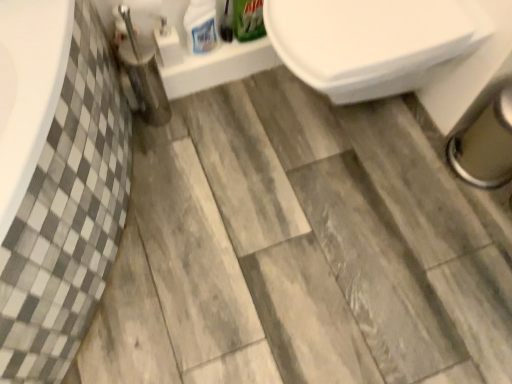
Where is `brushed metal toilet brush at lower left`? This screenshot has height=384, width=512. brushed metal toilet brush at lower left is located at coordinates (143, 74).

Describe the element at coordinates (248, 20) in the screenshot. I see `green matte box at upper center, acting as the second cleaning product starting from the left` at that location.

Describe the element at coordinates (201, 26) in the screenshot. I see `white glossy bottle at upper center, placed as the first cleaning product when sorted from left to right` at that location.

This screenshot has width=512, height=384. What do you see at coordinates (372, 42) in the screenshot?
I see `white glossy toilet at upper right` at bounding box center [372, 42].

This screenshot has height=384, width=512. Find the location of `brushed metal toilet brush at lower left`. brushed metal toilet brush at lower left is located at coordinates (143, 74).

Who is bigger, green matte box at upper center, which is the 1th cleaning product in right-to-left order, or white glossy bottle at upper center, which is the 2th cleaning product from right to left?

Bigger between the two is white glossy bottle at upper center, which is the 2th cleaning product from right to left.

From the image's perspective, between green matte box at upper center, which is the 1th cleaning product in right-to-left order, and white glossy bottle at upper center, placed as the first cleaning product when sorted from left to right, who is located below?

From the image's view, white glossy bottle at upper center, placed as the first cleaning product when sorted from left to right, is below.

Who is more distant, green matte box at upper center, which is the 1th cleaning product in right-to-left order, or white glossy bottle at upper center, placed as the first cleaning product when sorted from left to right?

green matte box at upper center, which is the 1th cleaning product in right-to-left order.

From a real-world perspective, between brushed metal toilet brush at lower left and green matte box at upper center, acting as the second cleaning product starting from the left, who is vertically higher?

green matte box at upper center, acting as the second cleaning product starting from the left, from a real-world perspective.

Is brushed metal toilet brush at lower left positioned with its back to green matte box at upper center, acting as the second cleaning product starting from the left?

No, brushed metal toilet brush at lower left's orientation is not away from green matte box at upper center, acting as the second cleaning product starting from the left.

Is point (141, 42) closer or farther from the camera than point (250, 15)?

Clearly, point (141, 42) is closer to the camera than point (250, 15).

Can you confirm if brushed metal toilet brush at lower left is shorter than green matte box at upper center, which is the 1th cleaning product in right-to-left order?

No.

From a real-world perspective, is green matte box at upper center, acting as the second cleaning product starting from the left, positioned above or below brushed metal toilet brush at lower left?

green matte box at upper center, acting as the second cleaning product starting from the left, is situated higher than brushed metal toilet brush at lower left in the real world.

Can you tell me how much green matte box at upper center, acting as the second cleaning product starting from the left, and brushed metal toilet brush at lower left differ in facing direction?

They differ by 2.97 degrees in their facing directions.

Considering the sizes of objects green matte box at upper center, acting as the second cleaning product starting from the left, and brushed metal toilet brush at lower left in the image provided, who is shorter, green matte box at upper center, acting as the second cleaning product starting from the left, or brushed metal toilet brush at lower left?

Standing shorter between the two is green matte box at upper center, acting as the second cleaning product starting from the left.

Choose the correct answer: Is green matte box at upper center, acting as the second cleaning product starting from the left, inside brushed metal toilet brush at lower left or outside it?

The correct answer is: outside.

From the picture: Considering the positions of objects white glossy bottle at upper center, placed as the first cleaning product when sorted from left to right, and green matte box at upper center, which is the 1th cleaning product in right-to-left order, in the image provided, who is in front, white glossy bottle at upper center, placed as the first cleaning product when sorted from left to right, or green matte box at upper center, which is the 1th cleaning product in right-to-left order,?

white glossy bottle at upper center, placed as the first cleaning product when sorted from left to right, is in front.

Does white glossy bottle at upper center, placed as the first cleaning product when sorted from left to right, turn towards green matte box at upper center, acting as the second cleaning product starting from the left?

No, white glossy bottle at upper center, placed as the first cleaning product when sorted from left to right, does not turn towards green matte box at upper center, acting as the second cleaning product starting from the left.

Considering the relative sizes of white glossy bottle at upper center, placed as the first cleaning product when sorted from left to right, and green matte box at upper center, which is the 1th cleaning product in right-to-left order, in the image provided, is white glossy bottle at upper center, placed as the first cleaning product when sorted from left to right, smaller than green matte box at upper center, which is the 1th cleaning product in right-to-left order,?

No, white glossy bottle at upper center, placed as the first cleaning product when sorted from left to right, is not smaller than green matte box at upper center, which is the 1th cleaning product in right-to-left order.

Does white glossy bottle at upper center, placed as the first cleaning product when sorted from left to right, appear on the right side of green matte box at upper center, acting as the second cleaning product starting from the left?

No.

Can you confirm if white glossy bottle at upper center, which is the 2th cleaning product from right to left, is wider than brushed metal toilet brush at lower left?

In fact, white glossy bottle at upper center, which is the 2th cleaning product from right to left, might be narrower than brushed metal toilet brush at lower left.

Is white glossy bottle at upper center, which is the 2th cleaning product from right to left, beside brushed metal toilet brush at lower left?

white glossy bottle at upper center, which is the 2th cleaning product from right to left, and brushed metal toilet brush at lower left are not in contact.

In the image, is white glossy bottle at upper center, placed as the first cleaning product when sorted from left to right, positioned in front of or behind brushed metal toilet brush at lower left?

Visually, white glossy bottle at upper center, placed as the first cleaning product when sorted from left to right, is located behind brushed metal toilet brush at lower left.

From a real-world perspective, is green matte box at upper center, which is the 1th cleaning product in right-to-left order, physically located above or below white glossy toilet at upper right?

green matte box at upper center, which is the 1th cleaning product in right-to-left order, is above white glossy toilet at upper right.

Who is shorter, green matte box at upper center, acting as the second cleaning product starting from the left, or white glossy toilet at upper right?

With less height is green matte box at upper center, acting as the second cleaning product starting from the left.

Is green matte box at upper center, which is the 1th cleaning product in right-to-left order, at the right side of white glossy toilet at upper right?

No, green matte box at upper center, which is the 1th cleaning product in right-to-left order, is not to the right of white glossy toilet at upper right.

This screenshot has width=512, height=384. Identify the location of toilet that appears below the green matte box at upper center, acting as the second cleaning product starting from the left (from the image's perspective). (372, 42).

From a real-world perspective, which is physically above, white glossy toilet at upper right or white glossy bottle at upper center, which is the 2th cleaning product from right to left?

In real-world perspective, white glossy bottle at upper center, which is the 2th cleaning product from right to left, is above.

Which of these two, white glossy toilet at upper right or white glossy bottle at upper center, placed as the first cleaning product when sorted from left to right, stands shorter?

white glossy bottle at upper center, placed as the first cleaning product when sorted from left to right, is shorter.

Between point (380, 56) and point (208, 31), which one is positioned behind?

Positioned behind is point (208, 31).

Considering the positions of objects white glossy toilet at upper right and white glossy bottle at upper center, placed as the first cleaning product when sorted from left to right, in the image provided, who is more to the left, white glossy toilet at upper right or white glossy bottle at upper center, placed as the first cleaning product when sorted from left to right,?

white glossy bottle at upper center, placed as the first cleaning product when sorted from left to right, is more to the left.

You are a GUI agent. You are given a task and a screenshot of the screen. Output one action in this format:
    pyautogui.click(x=<x>, y=<y>)
    Task: Click on the cleaning product lying below the green matte box at upper center, acting as the second cleaning product starting from the left (from the image's perspective)
    The image size is (512, 384).
    Given the screenshot: What is the action you would take?
    pyautogui.click(x=201, y=26)

The width and height of the screenshot is (512, 384). What are the coordinates of `the 2nd cleaning product behind the brushed metal toilet brush at lower left` in the screenshot? It's located at (248, 20).

Estimate the real-world distances between objects in this image. Which object is further from brushed metal toilet brush at lower left, white glossy bottle at upper center, which is the 2th cleaning product from right to left, or white glossy toilet at upper right?

white glossy toilet at upper right is positioned further to the anchor brushed metal toilet brush at lower left.

Based on their spatial positions, is brushed metal toilet brush at lower left or white glossy toilet at upper right closer to white glossy bottle at upper center, placed as the first cleaning product when sorted from left to right?

Based on the image, brushed metal toilet brush at lower left appears to be nearer to white glossy bottle at upper center, placed as the first cleaning product when sorted from left to right.

When comparing their distances from green matte box at upper center, acting as the second cleaning product starting from the left, does brushed metal toilet brush at lower left or white glossy toilet at upper right seem further?

white glossy toilet at upper right lies further to green matte box at upper center, acting as the second cleaning product starting from the left, than the other object.

When comparing their distances from white glossy toilet at upper right, does brushed metal toilet brush at lower left or green matte box at upper center, acting as the second cleaning product starting from the left, seem closer?

green matte box at upper center, acting as the second cleaning product starting from the left, lies closer to white glossy toilet at upper right than the other object.

Based on their spatial positions, is green matte box at upper center, which is the 1th cleaning product in right-to-left order, or brushed metal toilet brush at lower left closer to white glossy bottle at upper center, placed as the first cleaning product when sorted from left to right?

green matte box at upper center, which is the 1th cleaning product in right-to-left order, is positioned closer to the anchor white glossy bottle at upper center, placed as the first cleaning product when sorted from left to right.

Looking at the image, which one is located further to white glossy bottle at upper center, which is the 2th cleaning product from right to left, green matte box at upper center, which is the 1th cleaning product in right-to-left order, or white glossy toilet at upper right?

white glossy toilet at upper right is positioned further to the anchor white glossy bottle at upper center, which is the 2th cleaning product from right to left.

Considering their positions, is green matte box at upper center, which is the 1th cleaning product in right-to-left order, positioned further to white glossy toilet at upper right than brushed metal toilet brush at lower left?

brushed metal toilet brush at lower left is further to white glossy toilet at upper right.

Estimate the real-world distances between objects in this image. Which object is closer to brushed metal toilet brush at lower left, green matte box at upper center, which is the 1th cleaning product in right-to-left order, or white glossy toilet at upper right?

green matte box at upper center, which is the 1th cleaning product in right-to-left order, is positioned closer to the anchor brushed metal toilet brush at lower left.

You are a GUI agent. You are given a task and a screenshot of the screen. Output one action in this format:
    pyautogui.click(x=<x>, y=<y>)
    Task: Click on the cleaning product located between white glossy bottle at upper center, which is the 2th cleaning product from right to left, and white glossy toilet at upper right in the left-right direction
    The image size is (512, 384).
    Given the screenshot: What is the action you would take?
    pyautogui.click(x=248, y=20)

The height and width of the screenshot is (384, 512). I want to click on cleaning product between brushed metal toilet brush at lower left and green matte box at upper center, which is the 1th cleaning product in right-to-left order, so click(201, 26).